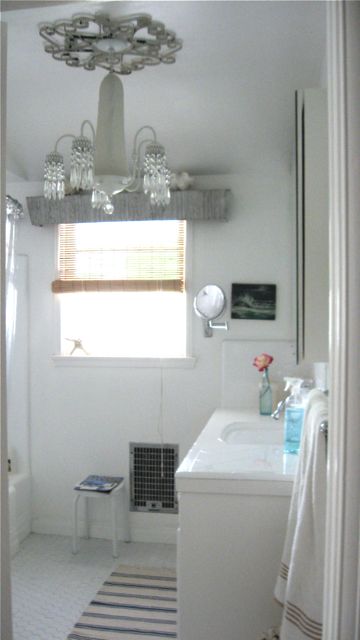
Find the location of a particular element. Image resolution: width=360 pixels, height=640 pixels. tub is located at coordinates (18, 502).